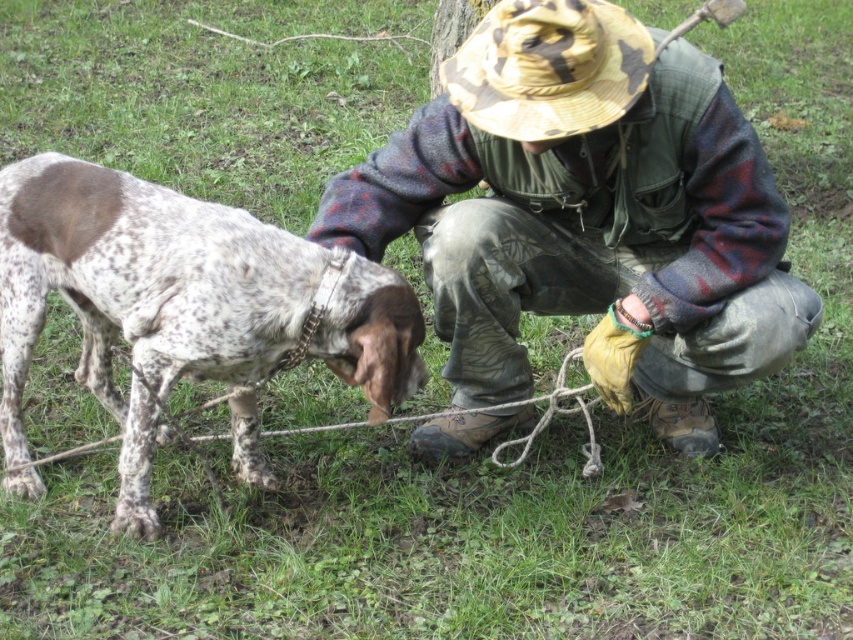
Question: Does speckled fur dog at center appear over camouflage fabric hat at upper center?

Choices:
 (A) no
 (B) yes

Answer: (A)

Question: Among these points, which one is farthest from the camera?

Choices:
 (A) pyautogui.click(x=228, y=252)
 (B) pyautogui.click(x=563, y=220)

Answer: (B)

Question: Which point is closer to the camera taking this photo?

Choices:
 (A) (189, 216)
 (B) (467, 176)

Answer: (A)

Question: From the image, what is the correct spatial relationship of camouflage hat at center in relation to camouflage fabric hat at upper center?

Choices:
 (A) above
 (B) below

Answer: (B)

Question: Which of the following is the farthest from the observer?

Choices:
 (A) camouflage fabric hat at upper center
 (B) speckled fur dog at center

Answer: (B)

Question: Is camouflage hat at center wider than speckled fur dog at center?

Choices:
 (A) no
 (B) yes

Answer: (B)